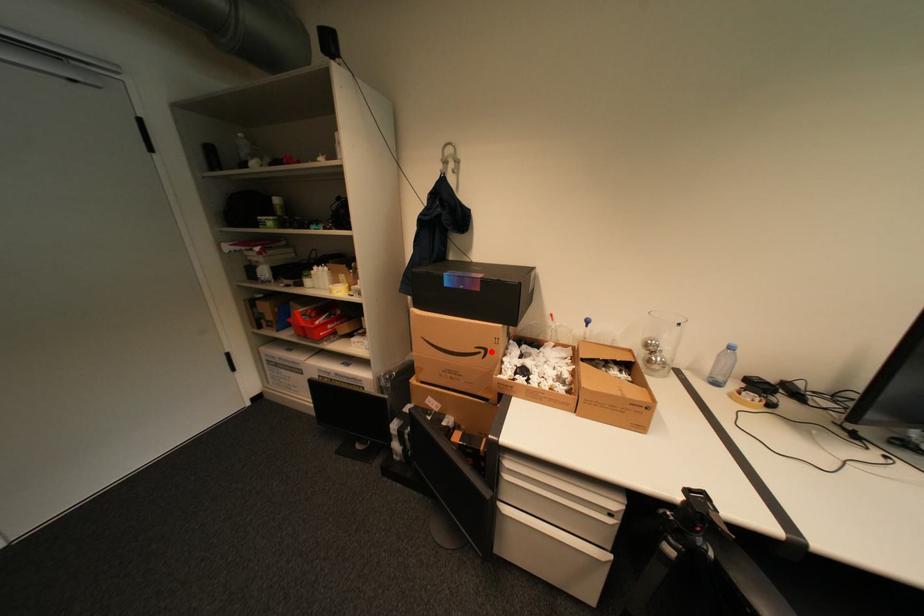
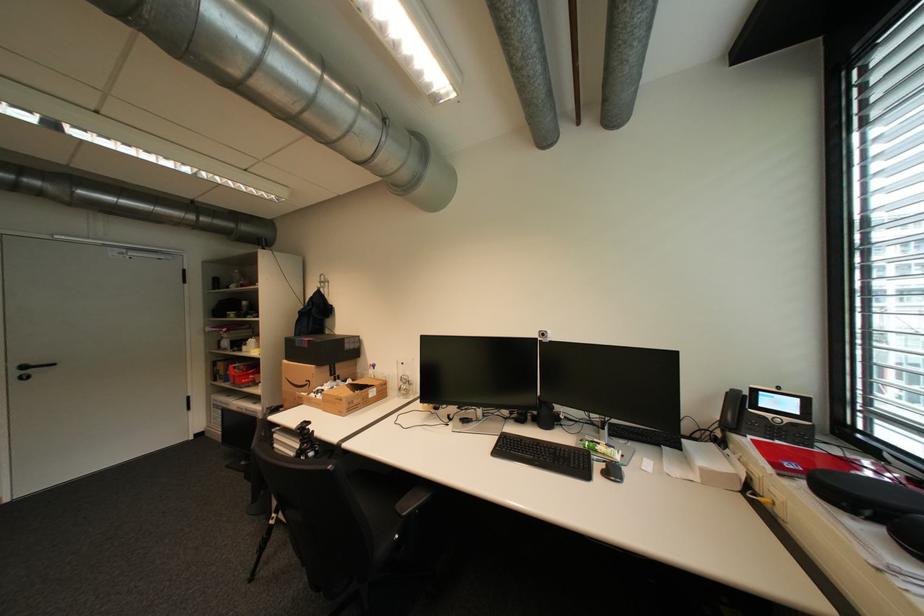
Find the pixel in the second image that matches the highlighted location in the first image.

(317, 383)